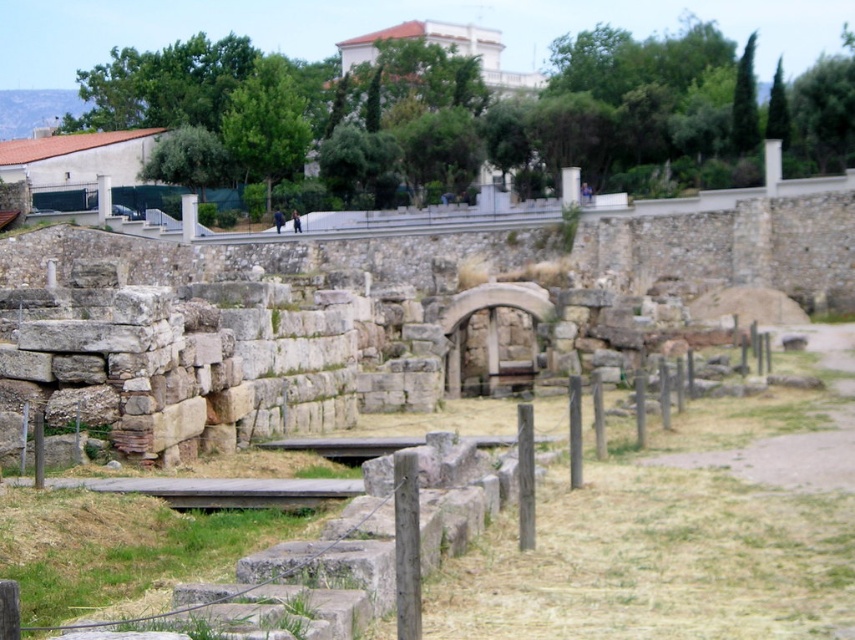
Between white stone pillar at center and smooth stone pillar at center, which one is positioned higher?

smooth stone pillar at center is above.

Which is in front, point (190, 230) or point (107, 180)?

Point (190, 230)

Where is `white stone pillar at center`? white stone pillar at center is located at coordinates (187, 216).